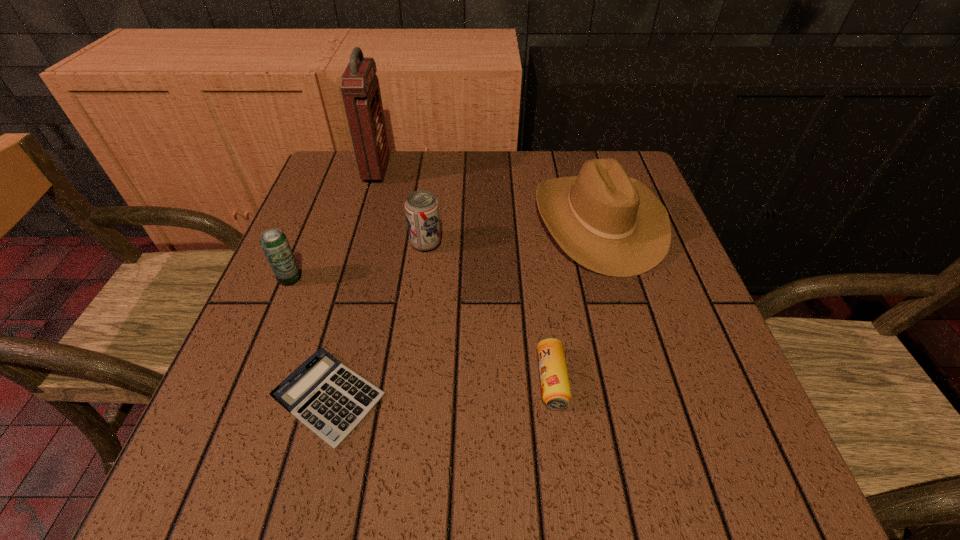
The width and height of the screenshot is (960, 540). Find the location of `free spot located 0.260m on the right of the farthest beer can`. free spot located 0.260m on the right of the farthest beer can is located at coordinates (563, 244).

Locate an element on the screen. This screenshot has width=960, height=540. free space located on the back of the leftmost object is located at coordinates (336, 167).

At what (x,y) coordinates should I click in order to perform the action: click on vacant space located on the right of the rightmost beer can. Please return your answer as a coordinate pair (x, y). The image size is (960, 540). Looking at the image, I should click on (689, 380).

Find the location of a particular element. The width and height of the screenshot is (960, 540). free location located on the right of the calculator is located at coordinates (608, 398).

Where is `the first-aid kit situated at the far edge`? This screenshot has height=540, width=960. the first-aid kit situated at the far edge is located at coordinates (359, 84).

What are the coordinates of `cowboy hat that is at the far edge` in the screenshot? It's located at (610, 223).

Locate an element on the screen. object at the near edge is located at coordinates (330, 399).

The image size is (960, 540). Find the location of `the first-aid kit present at the left edge`. the first-aid kit present at the left edge is located at coordinates (359, 84).

Where is `beer can at the left edge`? This screenshot has height=540, width=960. beer can at the left edge is located at coordinates (274, 243).

Image resolution: width=960 pixels, height=540 pixels. What are the coordinates of `calculator located at the left edge` in the screenshot? It's located at (330, 399).